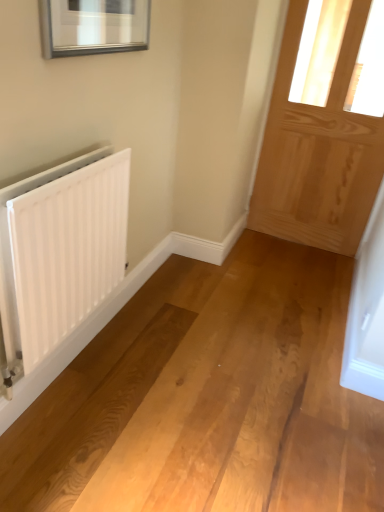
Where is `free space in front of natural wood door at right`? The height and width of the screenshot is (512, 384). free space in front of natural wood door at right is located at coordinates point(302,269).